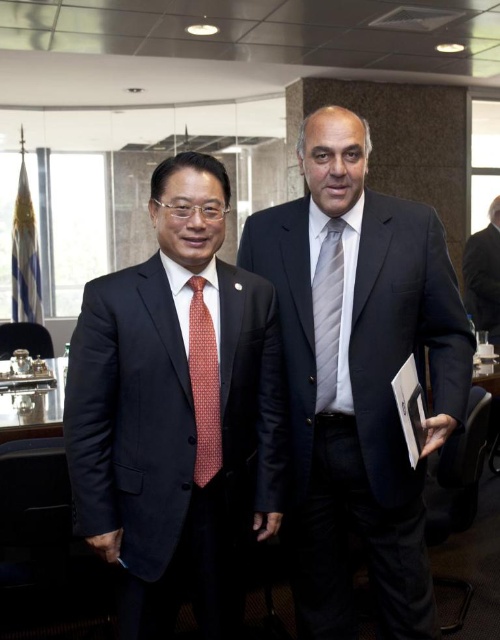
You are an event planner arranging seating for a meeting. You need to place a name tag on the table directly in front of the gray striped tie at center and the black suit at right. Which name tag should be placed to the left of the other?

The gray striped tie at center should have its name tag placed to the left of the black suit at right because the gray striped tie at center is positioned to the left of the black suit at right in the image.

You are organizing a formal event and need to ensure that all attire details are properly noted. Given the image, which object is smaller in size between the red dotted tie at left and the black suit at right?

The red dotted tie at left has a smaller size compared to the black suit at right.

You are an interior designer analyzing the spatial layout of this office. The red dotted tie at left is positioned at coordinates 0.603, 0.408. Can you determine if this position is closer to the left or right side of the frame?

The red dotted tie at left is positioned at coordinates (204, 385). Since the x coordinate is 0.603, which is closer to 1.0, the position is closer to the right side of the frame.